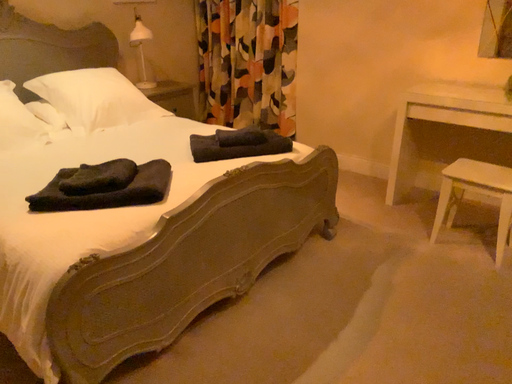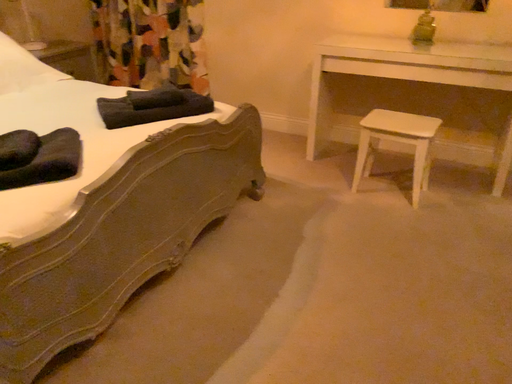
Question: Which way did the camera rotate in the video?

Choices:
 (A) rotated left
 (B) rotated right

Answer: (B)